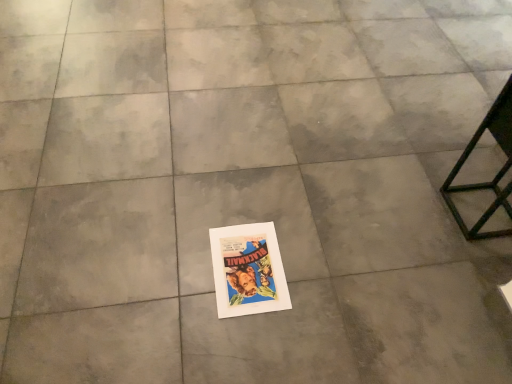
Where is `empty space that is ontop of vibrant paper poster at center (from a real-world perspective)`? empty space that is ontop of vibrant paper poster at center (from a real-world perspective) is located at coordinates (250, 266).